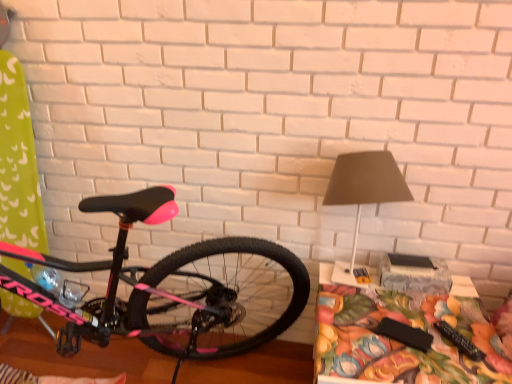
The height and width of the screenshot is (384, 512). Find the location of `empty space that is ontop of floral fabric table at lower right (from a real-world perspective)`. empty space that is ontop of floral fabric table at lower right (from a real-world perspective) is located at coordinates (406, 322).